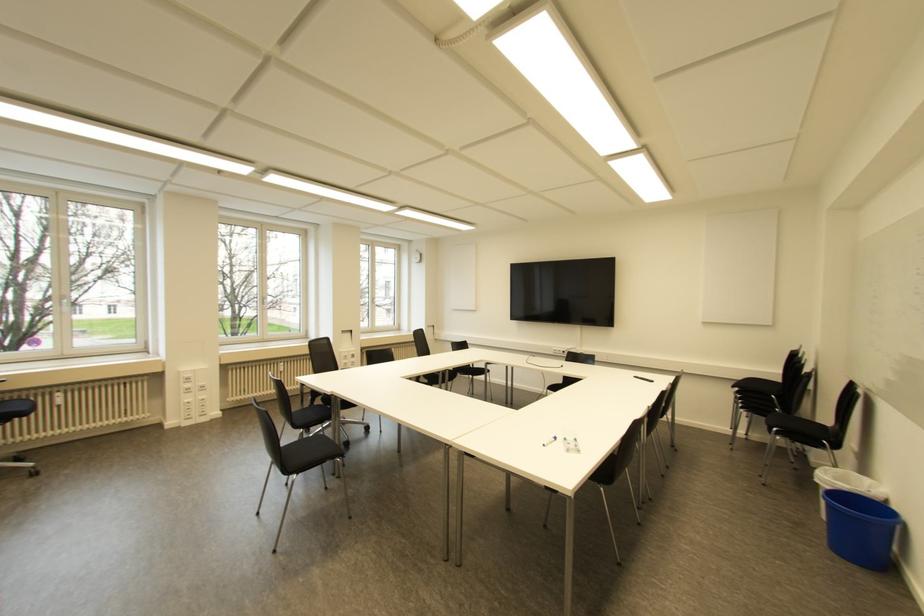
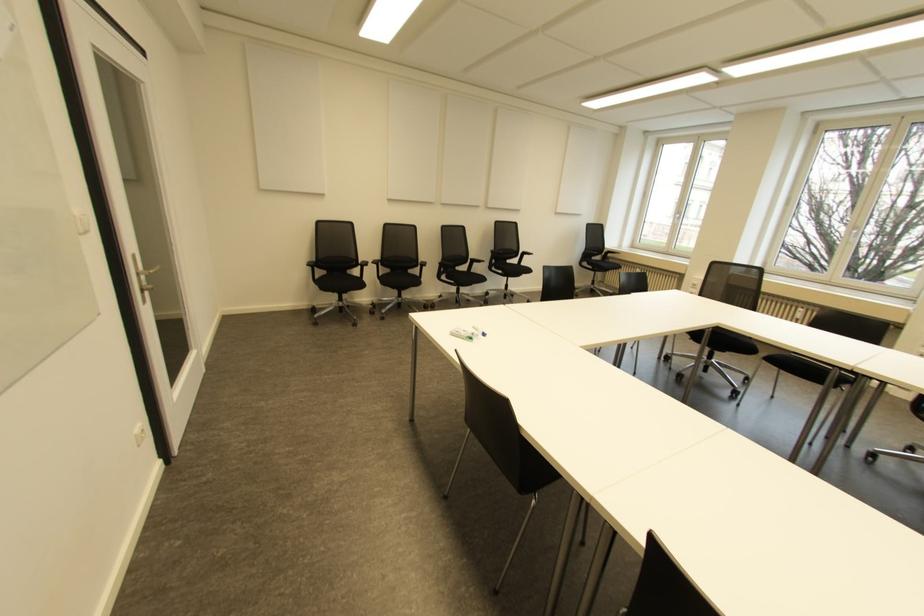
The point at (x=576, y=439) is marked in the first image. Where is the corresponding point in the second image?

(470, 338)